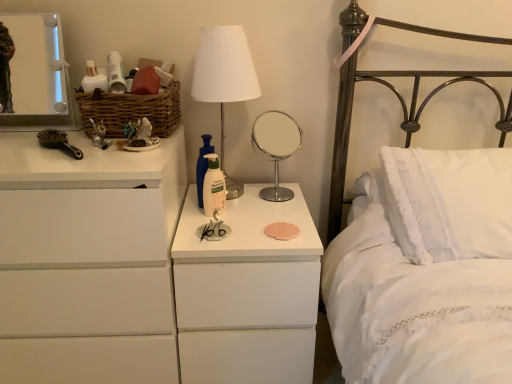
Question: Considering the relative sizes of white matte lotion at center and white matte chest of drawers at left in the image provided, is white matte lotion at center wider than white matte chest of drawers at left?

Choices:
 (A) yes
 (B) no

Answer: (B)

Question: Is white matte lotion at center in front of white matte chest of drawers at left?

Choices:
 (A) no
 (B) yes

Answer: (A)

Question: Considering the relative sizes of white matte lotion at center and white matte chest of drawers at left in the image provided, is white matte lotion at center bigger than white matte chest of drawers at left?

Choices:
 (A) yes
 (B) no

Answer: (B)

Question: Does white matte lotion at center have a lesser width compared to white matte chest of drawers at left?

Choices:
 (A) yes
 (B) no

Answer: (A)

Question: From the image's perspective, is white matte lotion at center under white matte chest of drawers at left?

Choices:
 (A) yes
 (B) no

Answer: (B)

Question: Considering their positions, is white matte lotion at center located in front of or behind white glossy nightstand at center?

Choices:
 (A) behind
 (B) front

Answer: (A)

Question: From the image's perspective, is white matte lotion at center positioned above or below white glossy nightstand at center?

Choices:
 (A) below
 (B) above

Answer: (B)

Question: Is white matte lotion at center to the left or to the right of white glossy nightstand at center in the image?

Choices:
 (A) right
 (B) left

Answer: (B)

Question: From a real-world perspective, is white matte lotion at center above or below white glossy nightstand at center?

Choices:
 (A) below
 (B) above

Answer: (B)

Question: From the image's perspective, relative to white fabric lampshade at center, is woven brown basket at upper left above or below?

Choices:
 (A) above
 (B) below

Answer: (A)

Question: Is woven brown basket at upper left spatially inside white fabric lampshade at center, or outside of it?

Choices:
 (A) inside
 (B) outside

Answer: (B)

Question: From their relative heights in the image, would you say woven brown basket at upper left is taller or shorter than white fabric lampshade at center?

Choices:
 (A) short
 (B) tall

Answer: (A)

Question: In terms of size, does woven brown basket at upper left appear bigger or smaller than white fabric lampshade at center?

Choices:
 (A) small
 (B) big

Answer: (A)

Question: From a real-world perspective, is white glossy nightstand at center above or below white fabric lampshade at center?

Choices:
 (A) above
 (B) below

Answer: (B)

Question: Does point (241, 276) appear closer or farther from the camera than point (203, 87)?

Choices:
 (A) farther
 (B) closer

Answer: (B)